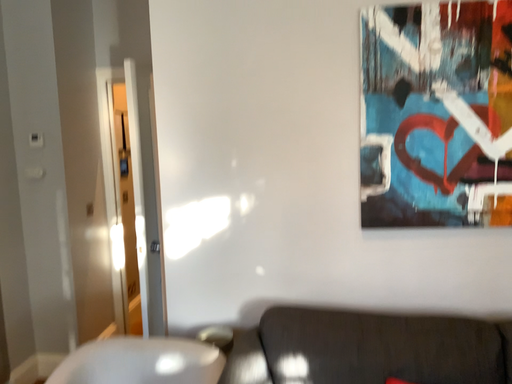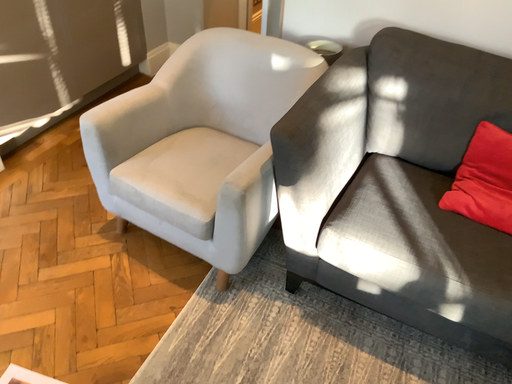
Question: Which way did the camera rotate in the video?

Choices:
 (A) rotated right
 (B) rotated left

Answer: (B)